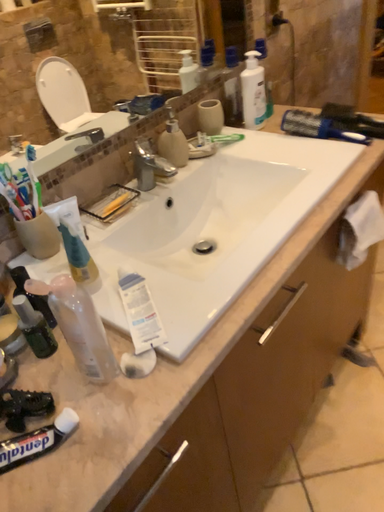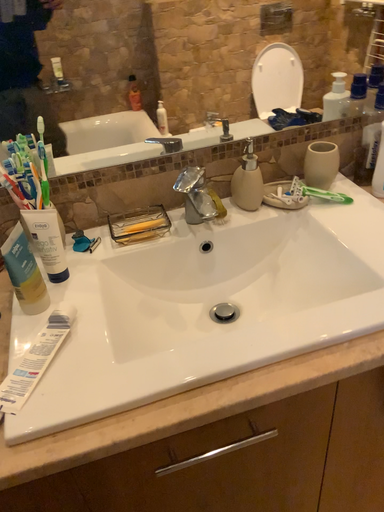
Question: How did the camera likely rotate when shooting the video?

Choices:
 (A) rotated right
 (B) rotated left

Answer: (B)